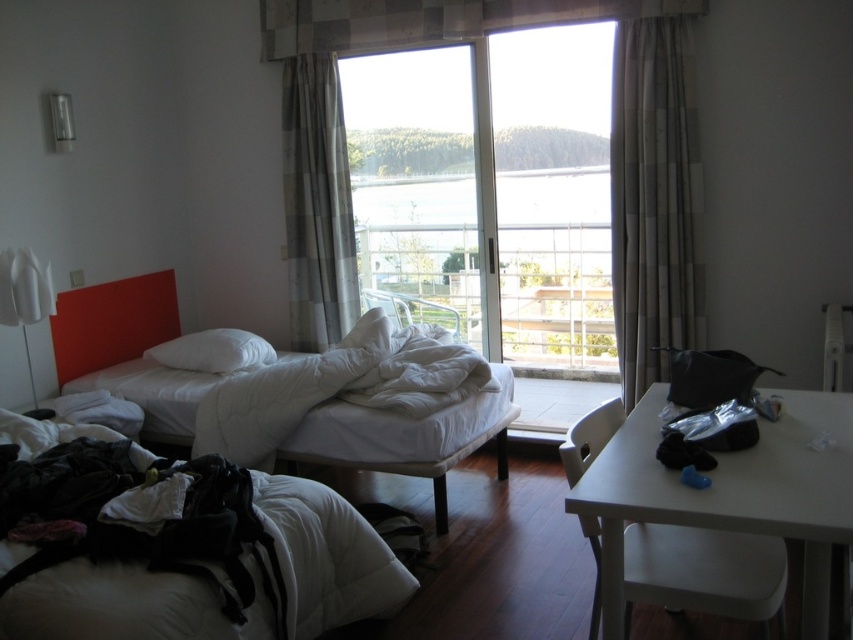
Between beige textured curtain at right and checkered fabric curtain at center, which one has less height?

checkered fabric curtain at center is shorter.

Who is higher up, beige textured curtain at right or checkered fabric curtain at center?

checkered fabric curtain at center

Between point (691, 324) and point (347, 291), which one is positioned in front?

Point (691, 324) is in front.

The height and width of the screenshot is (640, 853). Find the location of `beige textured curtain at right`. beige textured curtain at right is located at coordinates (653, 198).

Between point (486, 44) and point (627, 300), which one is positioned in front?

Point (627, 300)

Which is below, transparent glass screen door at center or beige textured curtain at right?

beige textured curtain at right is lower down.

Is point (425, 225) in front of point (695, 202)?

No, (425, 225) is further to viewer.

The image size is (853, 640). I want to click on transparent glass screen door at center, so click(426, 186).

Is transparent glass window at center taller than white plastic table at lower right?

Yes, transparent glass window at center is taller than white plastic table at lower right.

Between transparent glass window at center and white plastic table at lower right, which one has more height?

transparent glass window at center

This screenshot has height=640, width=853. Identify the location of transparent glass window at center. (491, 189).